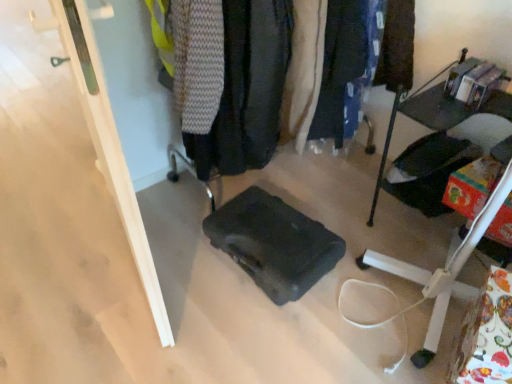
Identify the location of free spot to the left of metallic black shelf at right. (349, 218).